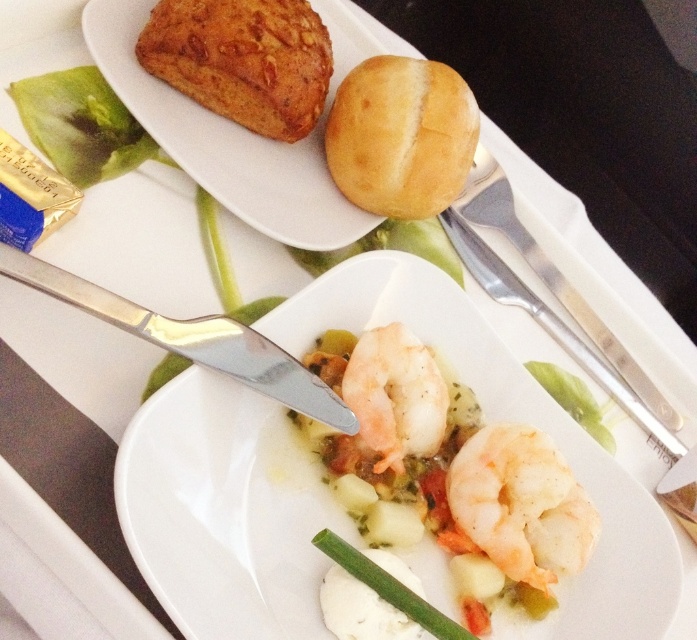
Does golden brown crumbly bread at upper left have a greater height compared to pale pink flesh at center?

Incorrect, golden brown crumbly bread at upper left's height is not larger of pale pink flesh at center's.

Does golden brown crumbly bread at upper left have a smaller size compared to pale pink flesh at center?

No, golden brown crumbly bread at upper left is not smaller than pale pink flesh at center.

Find the location of a particular element. golden brown crumbly bread at upper left is located at coordinates (243, 60).

Does point (496, 445) come closer to viewer compared to point (411, 333)?

Yes, it is.

Is pale pink flesh at center wider than white glossy shrimp at center?

Indeed, pale pink flesh at center has a greater width compared to white glossy shrimp at center.

Is point (519, 561) farther from camera compared to point (415, 387)?

No, it is in front of (415, 387).

Where is `pale pink flesh at center`? The height and width of the screenshot is (640, 697). pale pink flesh at center is located at coordinates (521, 504).

Consider the image. Can you confirm if green leafy vegetable at upper left is positioned below white glossy shrimp at center?

No.

Can you confirm if green leafy vegetable at upper left is thinner than white glossy shrimp at center?

In fact, green leafy vegetable at upper left might be wider than white glossy shrimp at center.

The width and height of the screenshot is (697, 640). Describe the element at coordinates (82, 125) in the screenshot. I see `green leafy vegetable at upper left` at that location.

You are a GUI agent. You are given a task and a screenshot of the screen. Output one action in this format:
    pyautogui.click(x=<x>, y=<y>)
    Task: Click on the green leafy vegetable at upper left
    The width and height of the screenshot is (697, 640).
    Given the screenshot: What is the action you would take?
    pyautogui.click(x=82, y=125)